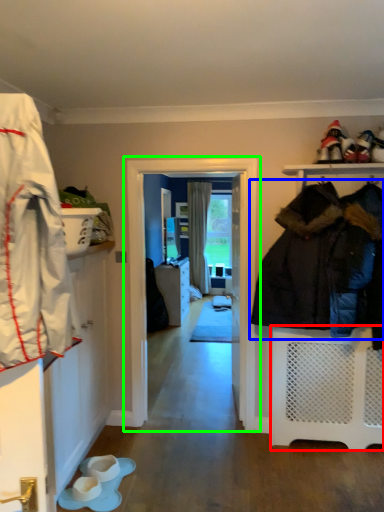
Question: Based on their relative distances, which object is nearer to shelf (highlighted by a red box)? Choose from jacket (highlighted by a blue box) and screen door (highlighted by a green box).

Choices:
 (A) jacket
 (B) screen door

Answer: (A)